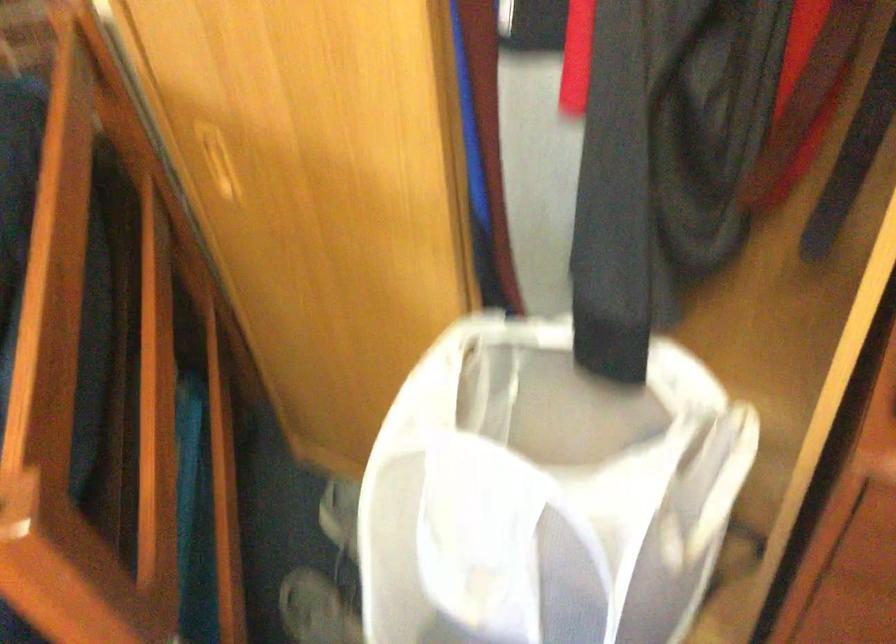
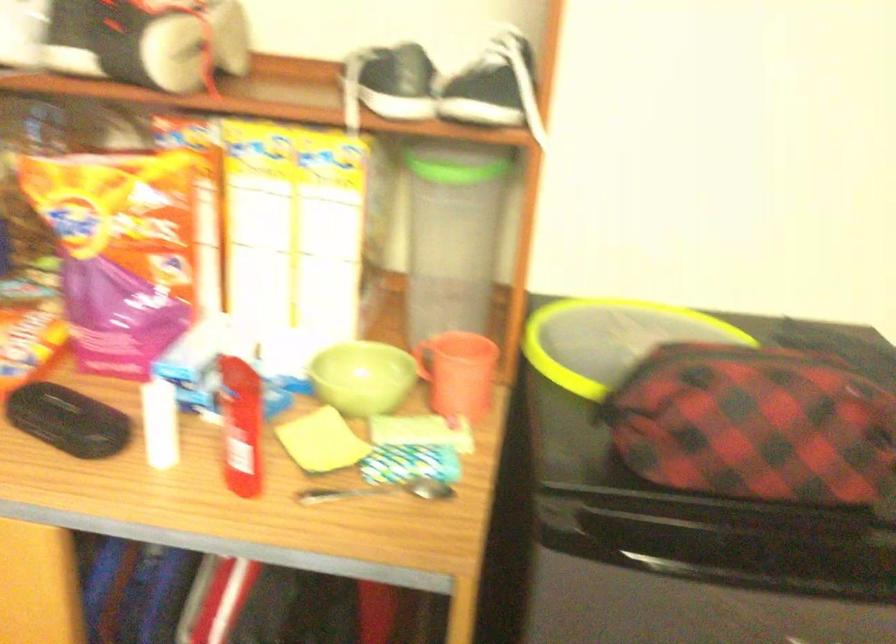
Based on the continuous images, in which direction is the camera rotating?

The camera rotated toward right-up.